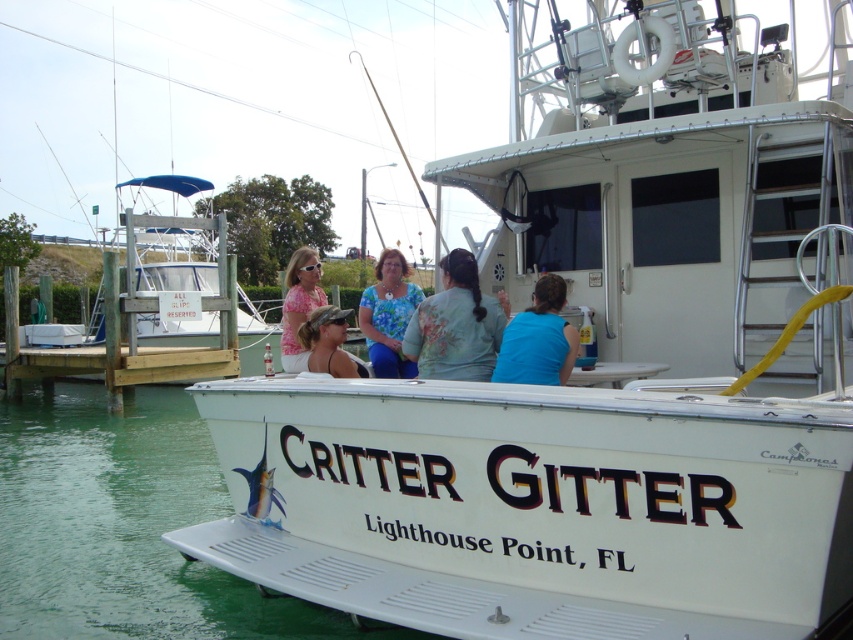
You are a photographer trying to capture a wide shot of the scene. Since the brown wooden dock at lower left and the blue fabric shirt at center are both in your view, which object should you focus on to ensure both are in frame without cropping?

The brown wooden dock at lower left is bigger than the blue fabric shirt at center, so focusing on the brown wooden dock at lower left would help ensure both objects are in frame without cropping.